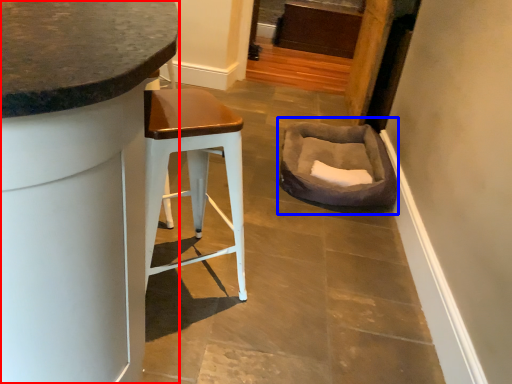
Question: Which object is closer to the camera taking this photo, cabinetry (highlighted by a red box) or bean bag chair (highlighted by a blue box)?

Choices:
 (A) cabinetry
 (B) bean bag chair

Answer: (A)